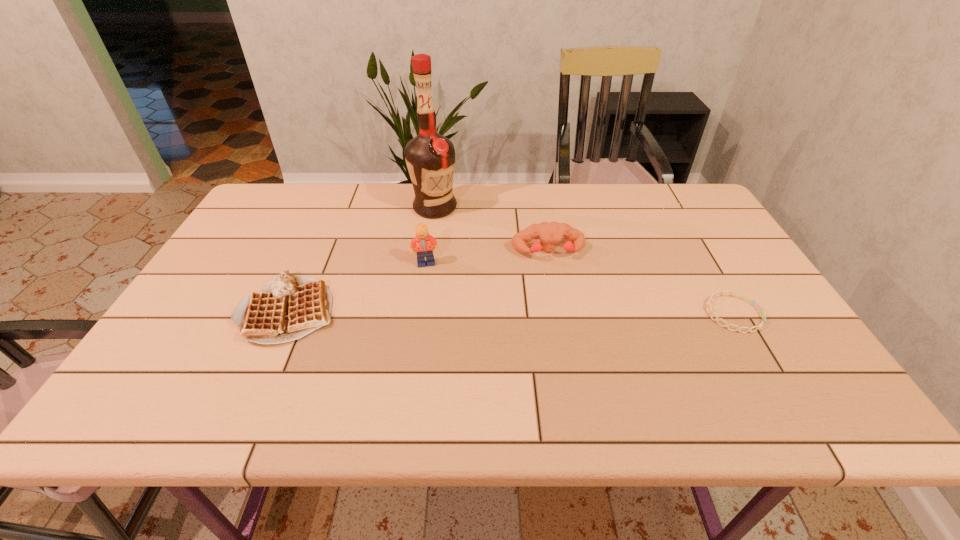
The height and width of the screenshot is (540, 960). Find the location of `object located at the near edge`. object located at the near edge is located at coordinates (289, 307).

At what (x,y) coordinates should I click in order to perform the action: click on object that is positioned at the left edge. Please return your answer as a coordinate pair (x, y). This screenshot has width=960, height=540. Looking at the image, I should click on (289, 307).

The height and width of the screenshot is (540, 960). Identify the location of object that is positioned at the right edge. (747, 298).

The image size is (960, 540). What are the coordinates of `object that is at the near left corner` in the screenshot? It's located at (289, 307).

You are a GUI agent. You are given a task and a screenshot of the screen. Output one action in this format:
    pyautogui.click(x=<x>, y=<y>)
    Task: Click on the vacant space at the far edge of the desktop
    The height and width of the screenshot is (540, 960).
    Given the screenshot: What is the action you would take?
    pyautogui.click(x=555, y=183)

In the image, there is a desktop. In order to click on free space at the near edge in this screenshot , I will do `click(420, 363)`.

This screenshot has width=960, height=540. Find the location of `free region at the left edge of the desktop`. free region at the left edge of the desktop is located at coordinates (211, 304).

In the image, there is a desktop. At what (x,y) coordinates should I click in order to perform the action: click on free region at the right edge. Please return your answer as a coordinate pair (x, y). The height and width of the screenshot is (540, 960). Looking at the image, I should click on (672, 234).

The image size is (960, 540). Find the location of `free spot at the far left corner of the desktop`. free spot at the far left corner of the desktop is located at coordinates (298, 194).

In the image, there is a desktop. Where is `vacant region at the near right corner`? The height and width of the screenshot is (540, 960). vacant region at the near right corner is located at coordinates (751, 366).